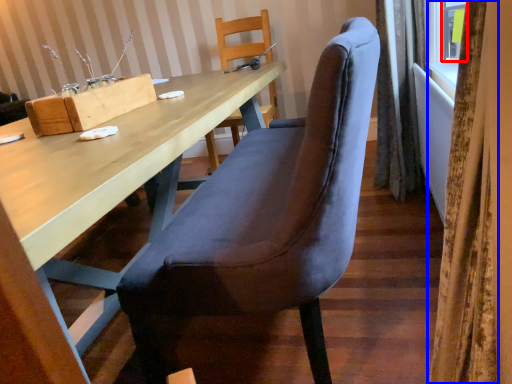
Question: Which object is closer to the camera taking this photo, window (highlighted by a red box) or curtain (highlighted by a blue box)?

Choices:
 (A) window
 (B) curtain

Answer: (B)